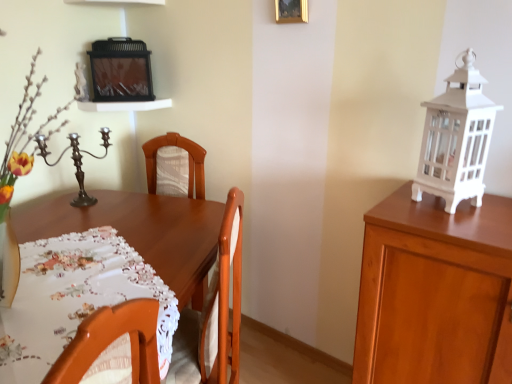
What are the coordinates of `free spot in front of white painted glass lantern at right` in the screenshot? It's located at (468, 223).